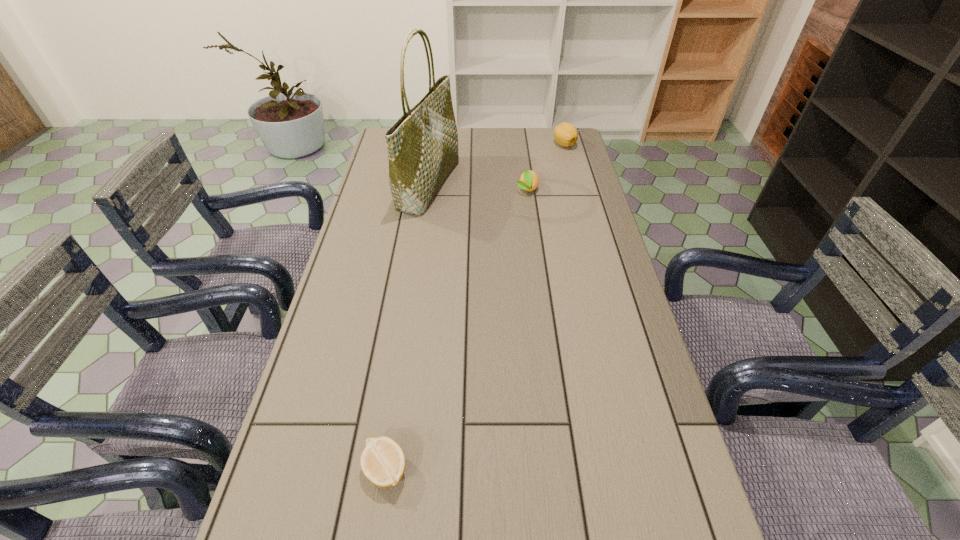
Locate an element on the screen. Image resolution: width=960 pixels, height=540 pixels. shopping bag is located at coordinates (422, 145).

The image size is (960, 540). What are the coordinates of `the tallest lemon` in the screenshot? It's located at (565, 134).

Identify the location of the farthest object. Image resolution: width=960 pixels, height=540 pixels. (565, 134).

Identify the location of the second farthest lemon. (529, 181).

This screenshot has width=960, height=540. What are the coordinates of `the second shortest lemon` in the screenshot? It's located at (529, 181).

I want to click on the shortest object, so click(382, 461).

Locate an element on the screen. This screenshot has width=960, height=540. the nearest object is located at coordinates (382, 461).

You are a GUI agent. You are given a task and a screenshot of the screen. Output one action in this format:
    pyautogui.click(x=<x>, y=<y>)
    Task: Click on the vacant space positioned on the back of the shopping bag
    This screenshot has height=540, width=960.
    Given the screenshot: What is the action you would take?
    pyautogui.click(x=434, y=146)

The height and width of the screenshot is (540, 960). In order to click on vacant space situated at the stem end of the rightmost lemon in this screenshot , I will do `click(574, 181)`.

Where is `vacant area located with leaves positioned above the second farthest lemon`? vacant area located with leaves positioned above the second farthest lemon is located at coordinates (535, 244).